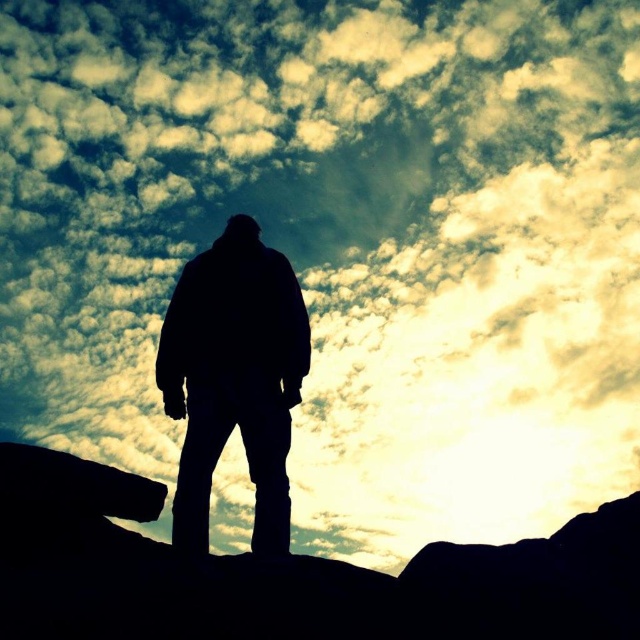
Question: Can you confirm if black rock at center is positioned to the left of silhouette jacket at center?

Choices:
 (A) yes
 (B) no

Answer: (B)

Question: Does black rock at center lie behind silhouette jacket at center?

Choices:
 (A) no
 (B) yes

Answer: (A)

Question: Among these objects, which one is nearest to the camera?

Choices:
 (A) black rock at center
 (B) silhouette jacket at center

Answer: (A)

Question: Can you confirm if black rock at center is positioned to the right of silhouette jacket at center?

Choices:
 (A) yes
 (B) no

Answer: (A)